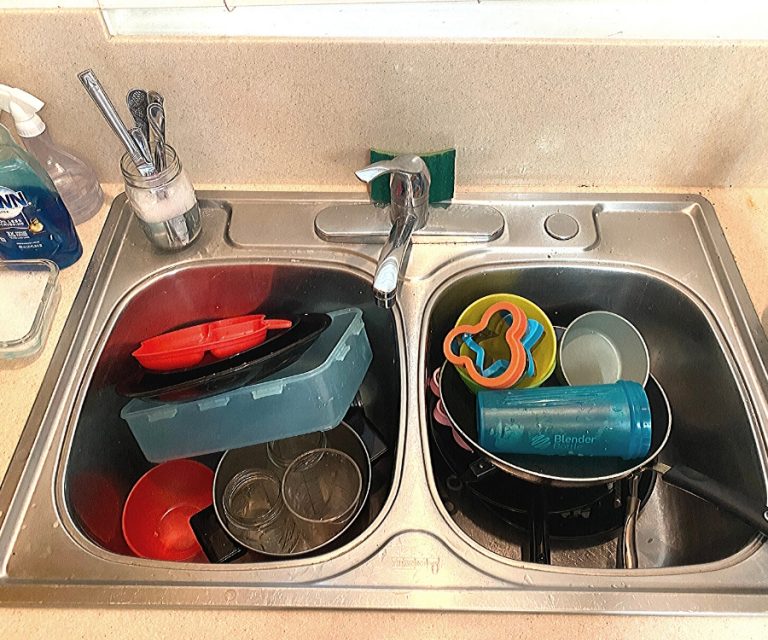
At what (x,y) coordinates should I click in order to perform the action: click on green sponge. Please return your answer as a coordinate pair (x, y). This screenshot has width=768, height=640. Looking at the image, I should click on (439, 173), (378, 191).